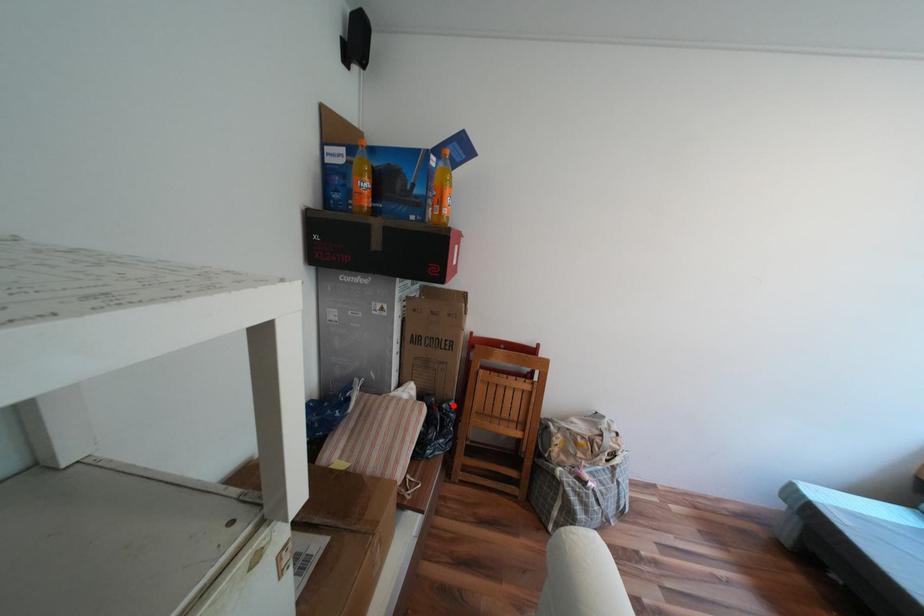
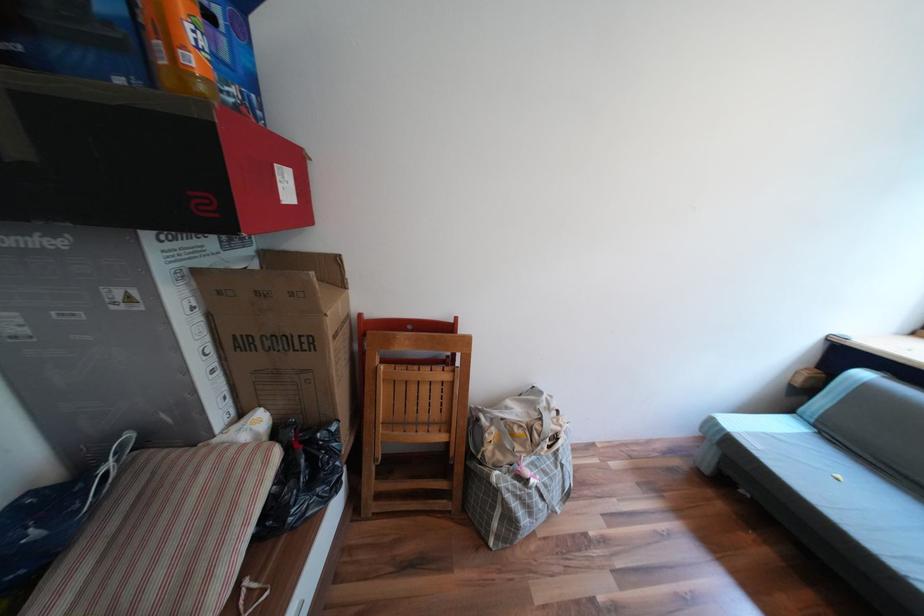
Locate, in the second image, the point that corresponds to the highlighted location in the first image.

(327, 435)